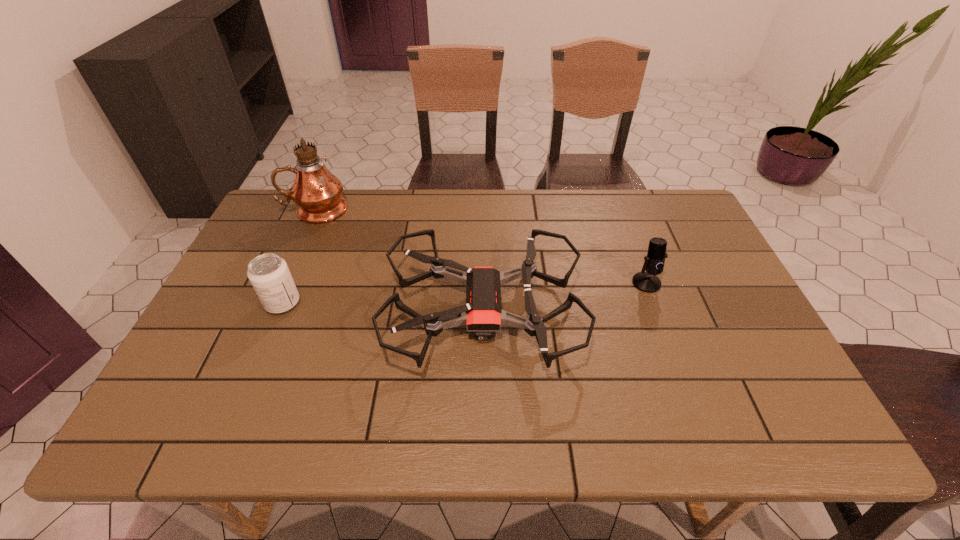
This screenshot has height=540, width=960. I want to click on free spot that satisfies the following two spatial constraints: 1. on the stand of the rightmost object; 2. with the camera facing forward on the second object from right to left, so click(658, 312).

Where is `free region that satisfies the following two spatial constraints: 1. on the stand of the rightmost object; 2. with the camera facing forward on the second object from right to left`? The width and height of the screenshot is (960, 540). free region that satisfies the following two spatial constraints: 1. on the stand of the rightmost object; 2. with the camera facing forward on the second object from right to left is located at coordinates (658, 312).